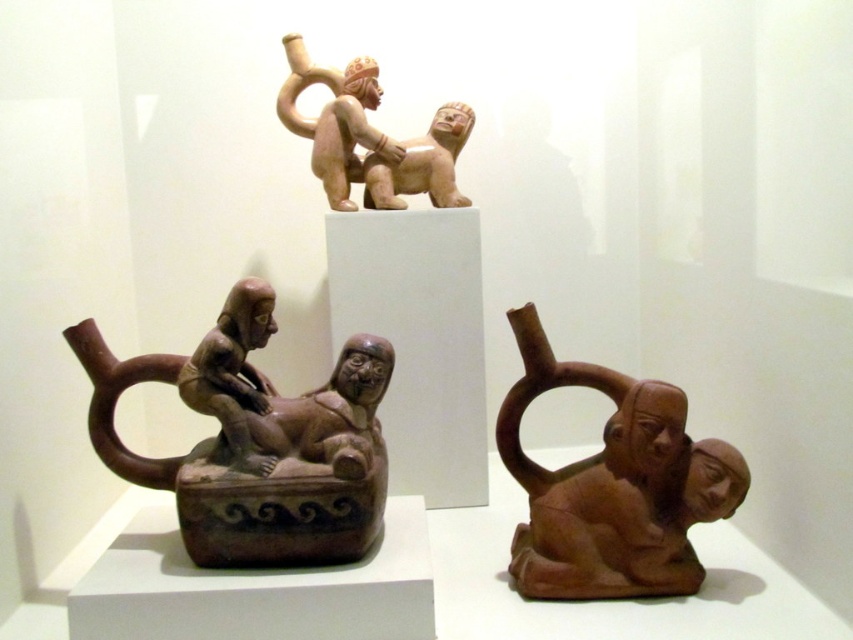
Question: Which point appears closest to the camera in this image?

Choices:
 (A) coord(347,81)
 (B) coord(210,532)
 (C) coord(498,417)

Answer: (B)

Question: Estimate the real-world distances between objects in this image. Which object is closer to the brown clay figure at center?

Choices:
 (A) brown matte clay figure at center
 (B) matte beige figure at upper center

Answer: (A)

Question: Can you confirm if brown clay figure at center is smaller than matte beige figure at upper center?

Choices:
 (A) yes
 (B) no

Answer: (B)

Question: Considering the relative positions of brown matte clay figure at center and matte beige figure at upper center in the image provided, where is brown matte clay figure at center located with respect to matte beige figure at upper center?

Choices:
 (A) above
 (B) below

Answer: (B)

Question: Does brown matte clay figure at center have a lesser width compared to matte beige figure at upper center?

Choices:
 (A) no
 (B) yes

Answer: (A)

Question: Which object is positioned closest to the matte beige figure at upper center?

Choices:
 (A) brown matte clay figure at center
 (B) brown clay figure at center

Answer: (A)